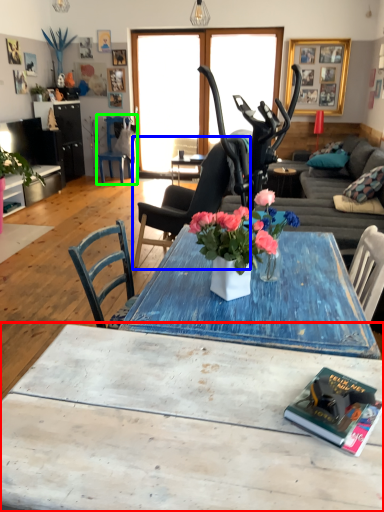
Question: Based on their relative distances, which object is farther from coffee table (highlighted by a red box)? Choose from chair (highlighted by a blue box) and chair (highlighted by a green box).

Choices:
 (A) chair
 (B) chair

Answer: (B)